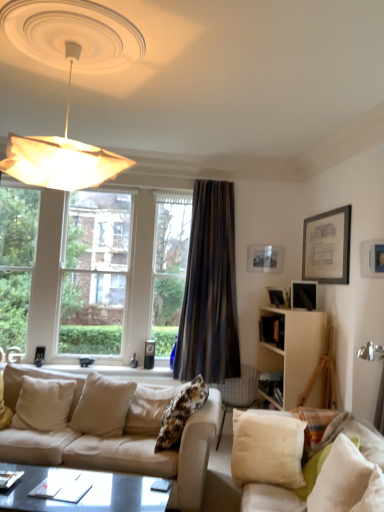
At what (x,y) coordinates should I click in order to perform the action: click on fluffy fabric pillow at center, placed as the 3th pillow when sorted from left to right. Please return your answer as a coordinate pair (x, y). The height and width of the screenshot is (512, 384). Looking at the image, I should click on (180, 413).

Based on the photo, in order to face matte black picture frame at upper right, the fourth picture frame from the left, should I rotate leftwards or rightwards?

To align with it, rotate right about 23.925°.

What is the approximate height of matte black picture frame at upper right, which appears as the first picture frame when viewed from the front?

It is 30.80 centimeters.

Identify the location of matte black picture frame at upper right, arranged as the 2th picture frame when viewed from the back. The height and width of the screenshot is (512, 384). (277, 297).

What do you see at coordinates (277, 297) in the screenshot? I see `matte black picture frame at upper right, arranged as the 2th picture frame when viewed from the back` at bounding box center [277, 297].

The image size is (384, 512). Identify the location of white cotton pillow at lower right, the fourth pillow when ordered from left to right. (267, 448).

This screenshot has height=512, width=384. What do you see at coordinates (295, 350) in the screenshot?
I see `white wood cabinet at right` at bounding box center [295, 350].

Find the location of `white wood cabinet at right`. white wood cabinet at right is located at coordinates (295, 350).

The width and height of the screenshot is (384, 512). I want to click on white fabric lampshade at upper left, so coord(61,155).

Considering the relative positions of matte black picture frame at upper right, arranged as the first picture frame when viewed from the right, and matte black picture frame at upper right, which is the fourth picture frame in right-to-left order, in the image provided, is matte black picture frame at upper right, arranged as the first picture frame when viewed from the right, to the left of matte black picture frame at upper right, which is the fourth picture frame in right-to-left order, from the viewer's perspective?

No.

From a real-world perspective, which object rests below the other?

From a 3D spatial view, matte black picture frame at upper right, which appears as the first picture frame when viewed from the front, is below.

Starting from the matte black picture frame at upper right, arranged as the first picture frame when viewed from the right, which picture frame is the 3rd one behind? Please provide its 2D coordinates.

[(265, 258)]

Is the depth of matte black picture frame at upper right, the fourth picture frame from the back, greater than that of matte black picture frame at upper right, which is counted as the first picture frame, starting from the back?

That is False.

From the image's perspective, is fluffy fabric pillow at center, the 3th pillow in the right-to-left sequence, located above or below white fabric lampshade at upper left?

fluffy fabric pillow at center, the 3th pillow in the right-to-left sequence, is below white fabric lampshade at upper left.

Are fluffy fabric pillow at center, the 3th pillow in the right-to-left sequence, and white fabric lampshade at upper left making contact?

No, fluffy fabric pillow at center, the 3th pillow in the right-to-left sequence, is not with white fabric lampshade at upper left.

Between fluffy fabric pillow at center, placed as the 3th pillow when sorted from left to right, and white fabric lampshade at upper left, which one is positioned behind?

fluffy fabric pillow at center, placed as the 3th pillow when sorted from left to right, is more distant.

From a real-world perspective, which is physically above, fluffy fabric pillow at center, the 3th pillow in the right-to-left sequence, or white fabric lampshade at upper left?

white fabric lampshade at upper left is physically above.

Considering the positions of objects matte black coffee table at lower center and white wood cabinet at right in the image provided, who is in front, matte black coffee table at lower center or white wood cabinet at right?

matte black coffee table at lower center is closer to the camera.

Looking at the image, does matte black coffee table at lower center seem bigger or smaller compared to white wood cabinet at right?

matte black coffee table at lower center is bigger than white wood cabinet at right.

Is there a large distance between matte black coffee table at lower center and white wood cabinet at right?

Yes.

Between white fabric couch at lower right, which appears as the first studio couch when viewed from the right, and white wood cabinet at right, which one has less height?

white fabric couch at lower right, which appears as the first studio couch when viewed from the right, is shorter.

Is white fabric couch at lower right, which appears as the 2th studio couch when viewed from the left, far from white wood cabinet at right?

Yes.

Could you tell me if white fabric couch at lower right, which appears as the 2th studio couch when viewed from the left, is turned towards white wood cabinet at right?

No, white fabric couch at lower right, which appears as the 2th studio couch when viewed from the left, is not oriented towards white wood cabinet at right.

From their relative heights in the image, would you say fluffy fabric pillow at center, placed as the 3th pillow when sorted from left to right, is taller or shorter than matte black picture frame at upper right, arranged as the first picture frame when viewed from the right?

Clearly, fluffy fabric pillow at center, placed as the 3th pillow when sorted from left to right, is taller compared to matte black picture frame at upper right, arranged as the first picture frame when viewed from the right.

Is point (181, 432) closer or farther from the camera than point (369, 246)?

Point (181, 432) is positioned closer to the camera compared to point (369, 246).

Relative to matte black picture frame at upper right, arranged as the first picture frame when viewed from the right, is fluffy fabric pillow at center, placed as the 3th pillow when sorted from left to right, in front or behind?

fluffy fabric pillow at center, placed as the 3th pillow when sorted from left to right, is in front of matte black picture frame at upper right, arranged as the first picture frame when viewed from the right.

Where is `the 1st pillow positioned below the matte black picture frame at upper right, arranged as the first picture frame when viewed from the right (from the image's perspective)`? the 1st pillow positioned below the matte black picture frame at upper right, arranged as the first picture frame when viewed from the right (from the image's perspective) is located at coordinates (180, 413).

Can you confirm if white wood cabinet at right is positioned to the left of white fabric couch at lower right, which appears as the first studio couch when viewed from the right?

No.

Is white wood cabinet at right taller or shorter than white fabric couch at lower right, which appears as the first studio couch when viewed from the right?

In the image, white wood cabinet at right appears to be taller than white fabric couch at lower right, which appears as the first studio couch when viewed from the right.

Is point (303, 345) closer or farther from the camera than point (370, 426)?

Point (303, 345) is farther from the camera than point (370, 426).

The height and width of the screenshot is (512, 384). I want to click on cabinetry above the white fabric couch at lower right, which appears as the 2th studio couch when viewed from the left (from the image's perspective), so click(295, 350).

Is white fabric couch at lower right, which appears as the 2th studio couch when viewed from the left, facing towards brown velvet curtain at center?

No, white fabric couch at lower right, which appears as the 2th studio couch when viewed from the left, does not turn towards brown velvet curtain at center.

Looking at their sizes, would you say white fabric couch at lower right, which appears as the 2th studio couch when viewed from the left, is wider or thinner than brown velvet curtain at center?

In the image, white fabric couch at lower right, which appears as the 2th studio couch when viewed from the left, appears to be wider than brown velvet curtain at center.

Does point (366, 443) appear closer or farther from the camera than point (232, 220)?

Point (366, 443).

From the picture: Would you consider white fabric couch at lower right, which appears as the 2th studio couch when viewed from the left, to be distant from brown velvet curtain at center?

Indeed, white fabric couch at lower right, which appears as the 2th studio couch when viewed from the left, is not near brown velvet curtain at center.

From the matte black picture frame at upper right, marked as the 4th picture frame in a front-to-back arrangement, count 3rd picture frames forward and point to it. Please provide its 2D coordinates.

[(372, 259)]

Find the location of a particular element. The height and width of the screenshot is (512, 384). lamp that is on the left side of fluffy fabric pillow at center, the 3th pillow in the right-to-left sequence is located at coordinates (61, 155).

Based on their spatial positions, is white fabric pillow at center, placed as the 4th pillow when sorted from right to left, or white soft pillow at lower right, the 5th pillow when ordered from left to right, closer to white wood cabinet at right?

Based on the image, white soft pillow at lower right, the 5th pillow when ordered from left to right, appears to be nearer to white wood cabinet at right.

When comparing their distances from beige fabric couch at lower left, positioned as the second studio couch in right-to-left order, does white cotton pillow at lower right, which ranks as the 2th pillow in right-to-left order, or matte black picture frame at upper right, which is the 1th picture frame in left-to-right order, seem further?

Among the two, matte black picture frame at upper right, which is the 1th picture frame in left-to-right order, is located further to beige fabric couch at lower left, positioned as the second studio couch in right-to-left order.

When comparing their distances from white fabric couch at lower right, which appears as the first studio couch when viewed from the right, does fluffy fabric pillow at center, the 3th pillow in the right-to-left sequence, or white soft pillow at lower right, the 5th pillow when ordered from left to right, seem further?

fluffy fabric pillow at center, the 3th pillow in the right-to-left sequence, is positioned further to the anchor white fabric couch at lower right, which appears as the first studio couch when viewed from the right.

Looking at this image, when comparing their distances from white fabric lampshade at upper left, does matte black picture frame at upper right, placed as the 3th picture frame when sorted from front to back, or fluffy fabric pillow at center, the 3th pillow in the right-to-left sequence, seem closer?

fluffy fabric pillow at center, the 3th pillow in the right-to-left sequence, lies closer to white fabric lampshade at upper left than the other object.

When comparing their distances from white fabric couch at lower right, which appears as the 2th studio couch when viewed from the left, does matte black picture frame at upper right, arranged as the 2th picture frame when viewed from the back, or matte black picture frame at upper right, which is counted as the first picture frame, starting from the back, seem further?

matte black picture frame at upper right, which is counted as the first picture frame, starting from the back, is further to white fabric couch at lower right, which appears as the 2th studio couch when viewed from the left.

In the scene shown: Looking at the image, which one is located closer to matte black picture frame at upper right, arranged as the first picture frame when viewed from the right, white fabric couch at lower right, which appears as the 2th studio couch when viewed from the left, or matte black picture frame at upper right, which is counted as the first picture frame, starting from the back?

matte black picture frame at upper right, which is counted as the first picture frame, starting from the back, lies closer to matte black picture frame at upper right, arranged as the first picture frame when viewed from the right, than the other object.

Looking at this image, estimate the real-world distances between objects in this image. Which object is closer to clear glass window at left, white fabric pillow at center, the second pillow viewed from the left, or matte black picture frame at upper right, arranged as the first picture frame when viewed from the right?

white fabric pillow at center, the second pillow viewed from the left, is closer to clear glass window at left.

Which object lies further to the anchor point white cotton pillow at lower right, the fourth pillow when ordered from left to right, matte black coffee table at lower center or matte black picture frame at upper right, positioned as the second picture frame in front-to-back order?

Among the two, matte black picture frame at upper right, positioned as the second picture frame in front-to-back order, is located further to white cotton pillow at lower right, the fourth pillow when ordered from left to right.

Locate an element on the screen. chair situated between white soft pillow at lower left, which is counted as the 1th pillow, starting from the left, and white cotton pillow at lower right, which ranks as the 2th pillow in right-to-left order, from left to right is located at coordinates (238, 393).

At what (x,y) coordinates should I click in order to perform the action: click on cabinetry located between brown velvet curtain at center and matte black picture frame at upper right, arranged as the first picture frame when viewed from the right, in the left-right direction. Please return your answer as a coordinate pair (x, y). The height and width of the screenshot is (512, 384). Looking at the image, I should click on (295, 350).

Locate an element on the screen. coffee table between white fabric couch at lower right, which appears as the 2th studio couch when viewed from the left, and brown velvet curtain at center in the front-back direction is located at coordinates (86, 493).

Identify the location of cabinetry located between clear glass window at left and matte black picture frame at upper right, the fourth picture frame from the back, in the left-right direction. The width and height of the screenshot is (384, 512). 295,350.